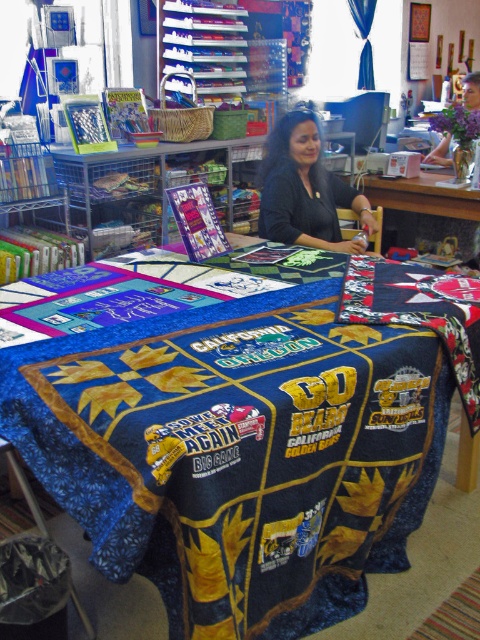
Question: Is blue fabric quilt at center bigger than metallic wire bookshelf at center?

Choices:
 (A) yes
 (B) no

Answer: (A)

Question: Is blue fabric quilt at center thinner than black fabric at center?

Choices:
 (A) no
 (B) yes

Answer: (A)

Question: Among these objects, which one is farthest from the camera?

Choices:
 (A) wooden table at center
 (B) blue fabric quilt at center
 (C) black fabric at center

Answer: (A)

Question: Among these points, which one is farthest from the camera?

Choices:
 (A) (0, 372)
 (B) (139, 228)
 (C) (396, 180)
 (D) (265, 188)

Answer: (C)

Question: Which object is positioned farthest from the wooden table at center?

Choices:
 (A) black fabric at center
 (B) blue fabric quilt at center

Answer: (B)

Question: Does metallic wire bookshelf at center have a greater width compared to wooden table at center?

Choices:
 (A) no
 (B) yes

Answer: (B)